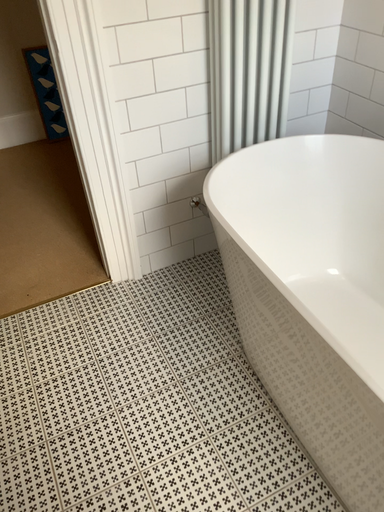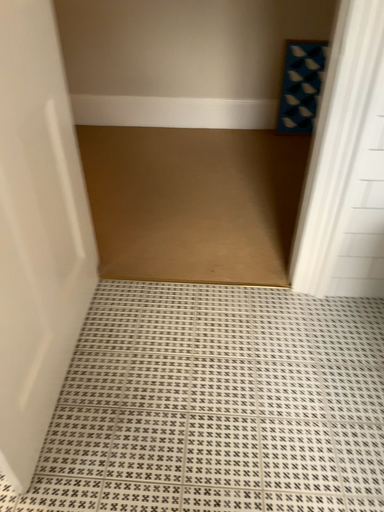
Question: How did the camera likely rotate when shooting the video?

Choices:
 (A) rotated right
 (B) rotated left

Answer: (B)